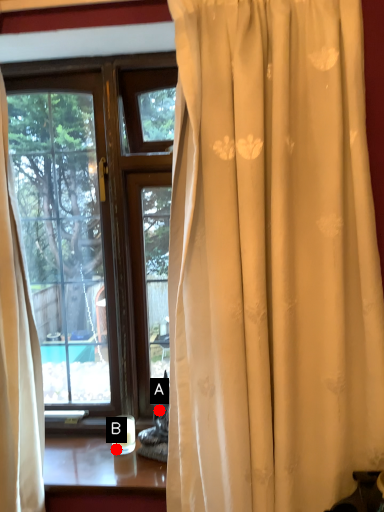
Question: Two points are circled on the image, labeled by A and B beside each circle. Which point appears closest to the camera in this image?

Choices:
 (A) A is closer
 (B) B is closer

Answer: (B)